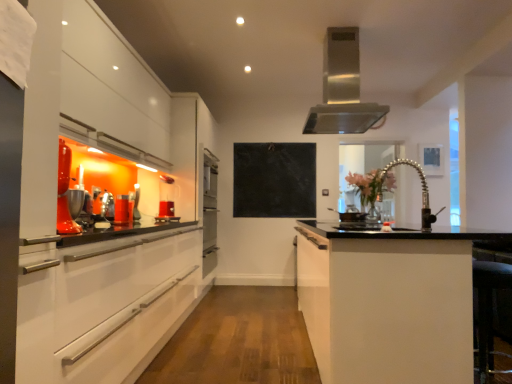
Question: From their relative heights in the image, would you say translucent glass cup at left, arranged as the first appliance when viewed from the front, is taller or shorter than stainless steel range hood at upper center?

Choices:
 (A) tall
 (B) short

Answer: (B)

Question: From the image's perspective, relative to stainless steel range hood at upper center, is translucent glass cup at left, arranged as the first appliance when viewed from the front, above or below?

Choices:
 (A) below
 (B) above

Answer: (A)

Question: Estimate the real-world distances between objects in this image. Which object is closer to the stainless steel range hood at upper center?

Choices:
 (A) white glossy cabinetry at left, arranged as the first cabinetry when viewed from the left
 (B) translucent glass cup at left, arranged as the first appliance when viewed from the front
 (C) black marble bulletin board at center
 (D) satin nickel faucet at center
 (E) black matte stove at center, arranged as the first appliance when viewed from the back

Answer: (E)

Question: Which object is positioned closest to the stainless steel range hood at upper center?

Choices:
 (A) white matte cabinet at center, which is the 1th cabinetry in right-to-left order
 (B) satin nickel faucet at center
 (C) translucent glass vase at center
 (D) white glossy cabinetry at left, arranged as the first cabinetry when viewed from the left
 (E) black marble bulletin board at center

Answer: (B)